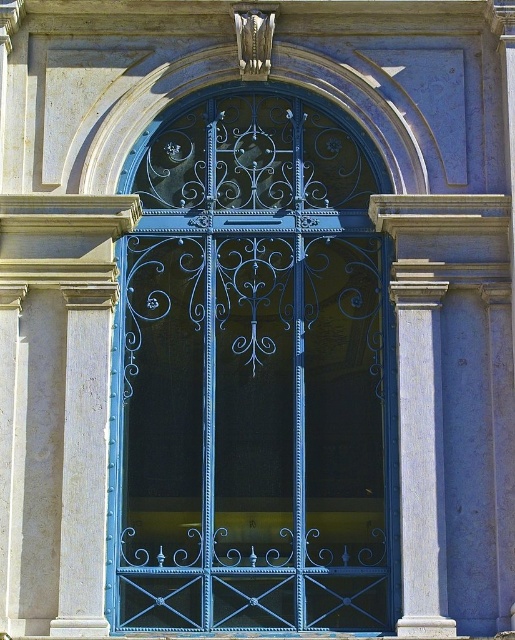
You are an architect designing a pathway between the white marble column at right and the smooth stone column at left. If the path must be 1 meter wide, will there be enough space between them?

The white marble column at right is narrower than the smooth stone column at left. However, the description only provides information about their widths, not the distance between them. Without knowing the actual spacing between the two columns, it is impossible to determine if the 1 meter wide path can fit.

Please provide the coordinates of the blue wrought iron door at center in the image.

The blue wrought iron door at center is located at coordinates point (253, 374).